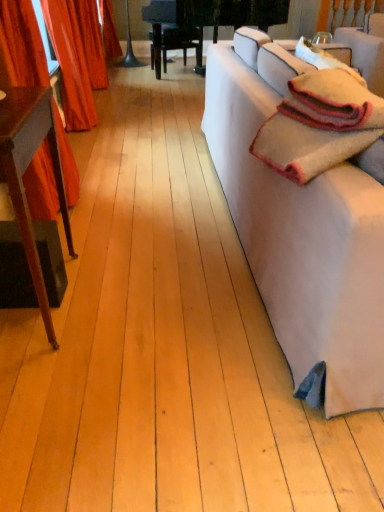
Question: Is white fabric couch at right behind soft woolen blanket at right?

Choices:
 (A) yes
 (B) no

Answer: (B)

Question: Can you confirm if white fabric couch at right is thinner than soft woolen blanket at right?

Choices:
 (A) no
 (B) yes

Answer: (A)

Question: Is white fabric couch at right looking in the opposite direction of soft woolen blanket at right?

Choices:
 (A) no
 (B) yes

Answer: (B)

Question: From a real-world perspective, is white fabric couch at right physically below soft woolen blanket at right?

Choices:
 (A) yes
 (B) no

Answer: (A)

Question: Does white fabric couch at right have a greater width compared to soft woolen blanket at right?

Choices:
 (A) no
 (B) yes

Answer: (B)

Question: Is white fabric couch at right to the right of soft woolen blanket at right from the viewer's perspective?

Choices:
 (A) yes
 (B) no

Answer: (A)

Question: Are mahogany wood table at left and soft woolen blanket at right far apart?

Choices:
 (A) no
 (B) yes

Answer: (A)

Question: From a real-world perspective, is mahogany wood table at left below soft woolen blanket at right?

Choices:
 (A) no
 (B) yes

Answer: (B)

Question: Is the surface of mahogany wood table at left in direct contact with soft woolen blanket at right?

Choices:
 (A) yes
 (B) no

Answer: (B)

Question: Considering the relative positions of mahogany wood table at left and soft woolen blanket at right in the image provided, is mahogany wood table at left to the right of soft woolen blanket at right from the viewer's perspective?

Choices:
 (A) yes
 (B) no

Answer: (B)

Question: Can you confirm if mahogany wood table at left is shorter than soft woolen blanket at right?

Choices:
 (A) yes
 (B) no

Answer: (B)

Question: From the image's perspective, is mahogany wood table at left over soft woolen blanket at right?

Choices:
 (A) yes
 (B) no

Answer: (B)

Question: Is velvet red curtain at left, marked as the 1th curtain in a front-to-back arrangement, to the right of white fabric couch at right from the viewer's perspective?

Choices:
 (A) yes
 (B) no

Answer: (B)